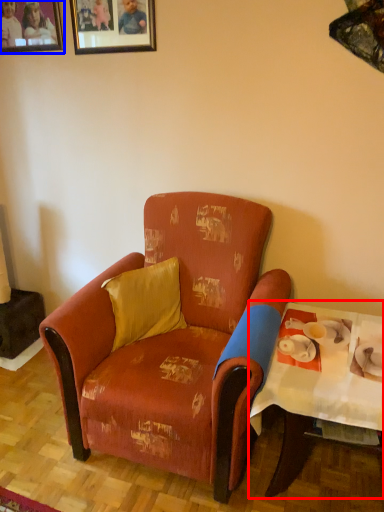
Question: Which object appears closest to the camera in this image, table (highlighted by a red box) or picture frame (highlighted by a blue box)?

Choices:
 (A) table
 (B) picture frame

Answer: (A)